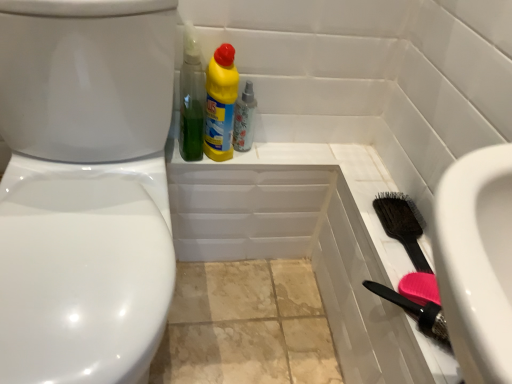
Question: Is floral-patterned glass spray bottle at upper center taller or shorter than white glossy bidet at left?

Choices:
 (A) short
 (B) tall

Answer: (A)

Question: Looking at the image, does floral-patterned glass spray bottle at upper center seem bigger or smaller compared to white glossy bidet at left?

Choices:
 (A) big
 (B) small

Answer: (B)

Question: Which of these objects is positioned farthest from the white glossy bidet at left?

Choices:
 (A) black bristle brush at right
 (B) green plastic bottle at upper center, positioned as the 2th cleaning product in right-to-left order
 (C) floral-patterned glass spray bottle at upper center
 (D) yellow plastic bottle at upper center, the 2th cleaning product positioned from the left

Answer: (A)

Question: Which is nearer to the yellow plastic bottle at upper center, the 2th cleaning product positioned from the left?

Choices:
 (A) green plastic bottle at upper center, positioned as the 2th cleaning product in right-to-left order
 (B) black bristle brush at right
 (C) white glossy bidet at left
 (D) floral-patterned glass spray bottle at upper center

Answer: (A)